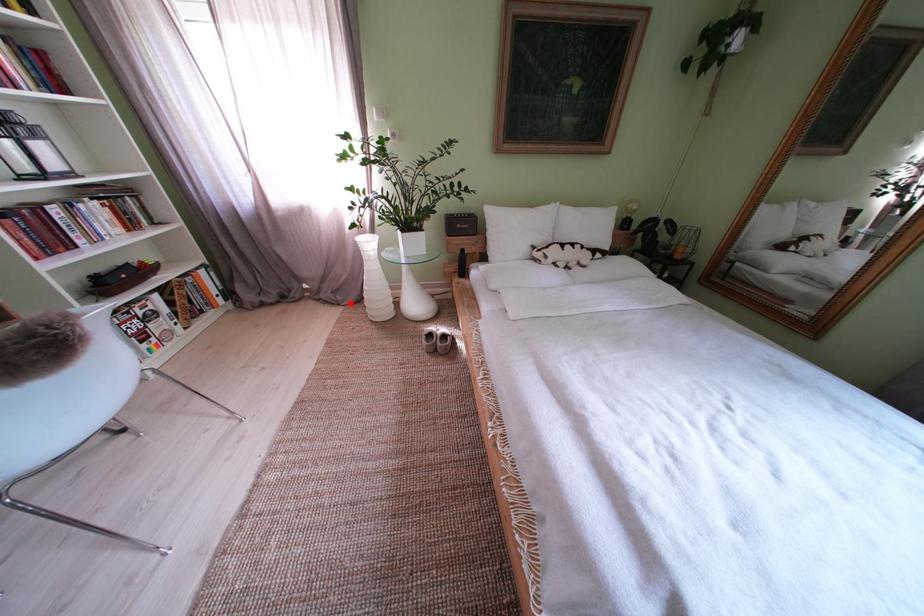
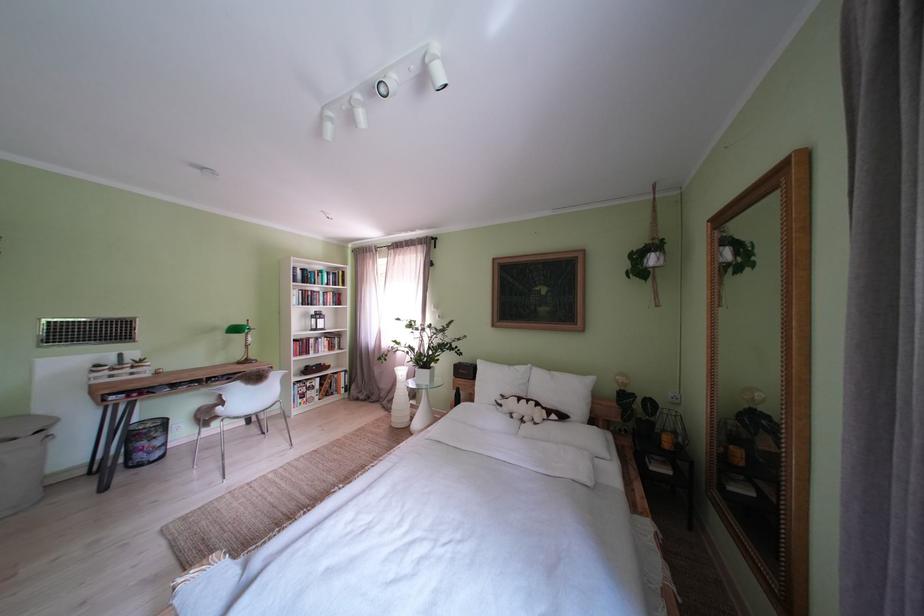
Question: A red point is marked in image1. In image2, is the corresponding 3D point closer to the camera or farther? Reply with the corresponding letter.

Choices:
 (A) The corresponding 3D point is closer.
 (B) The corresponding 3D point is farther.

Answer: (B)